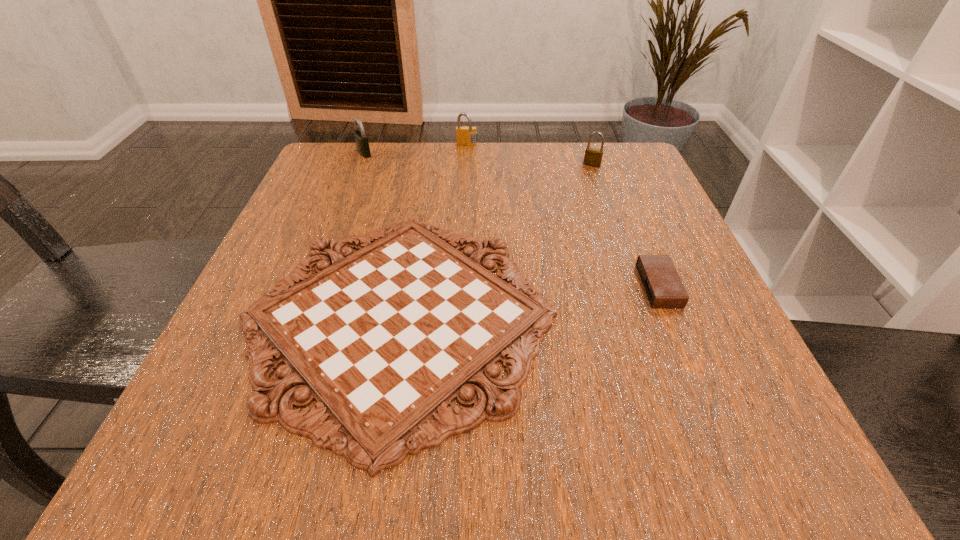
Locate an element on the screen. unoccupied area between the leftmost padlock and the nearest padlock is located at coordinates (478, 159).

What are the coordinates of `vacant area that lies between the nearest padlock and the leftmost padlock` in the screenshot? It's located at (478, 159).

Identify the location of free point between the third farthest object and the alarm clock. The image size is (960, 540). (625, 226).

This screenshot has height=540, width=960. Identify the location of free space between the third farthest object and the alarm clock. (625, 226).

Find the location of `free space between the leftmost padlock and the alarm clock`. free space between the leftmost padlock and the alarm clock is located at coordinates (512, 219).

Locate an element on the screen. This screenshot has height=540, width=960. vacant space that is in between the second padlock from right to left and the alarm clock is located at coordinates (563, 216).

Point out which object is positioned as the fourth nearest to the second padlock from right to left. Please provide its 2D coordinates. Your answer should be formatted as a tuple, i.e. [(x, y)], where the tuple contains the x and y coordinates of a point satisfying the conditions above.

[(663, 286)]

What are the coordinates of `object that ranks as the closest to the third farthest object` in the screenshot? It's located at (384, 339).

Identify which padlock is the third nearest to the alarm clock. Please provide its 2D coordinates. Your answer should be formatted as a tuple, i.e. [(x, y)], where the tuple contains the x and y coordinates of a point satisfying the conditions above.

[(361, 139)]

Where is `the third closest padlock to the alarm clock`? Image resolution: width=960 pixels, height=540 pixels. the third closest padlock to the alarm clock is located at coordinates (361, 139).